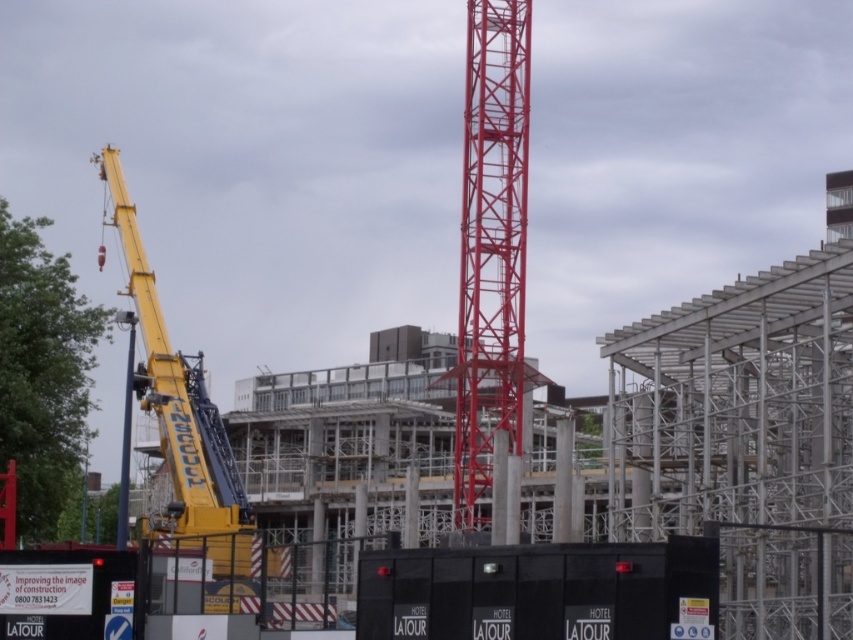
You are an inspector who needs to assess the safety of the black rubber lift at lower center and the metallic red crane at center. Which object is shorter in height?

The black rubber lift at lower center has a lesser height compared to the metallic red crane at center, so the black rubber lift at lower center is shorter in height.

You are a construction worker who needs to move a heavy beam from the yellow metallic crane at left to the blue painted metal pole at left. Which object is closer to the starting point of the beam?

The yellow metallic crane at left is positioned on the right side of the blue painted metal pole at left, so the blue painted metal pole at left is closer to the starting point of the beam.

You are a construction worker on the black rubber lift at lower center. You need to move closer to the metallic red crane at center to assist with a task. Is the distance between you and the crane manageable for you to reach it by walking around the construction site?

The black rubber lift at lower center is closer to the viewer than the metallic red crane at center, so the distance between them is manageable for you to reach it by walking around the construction site.